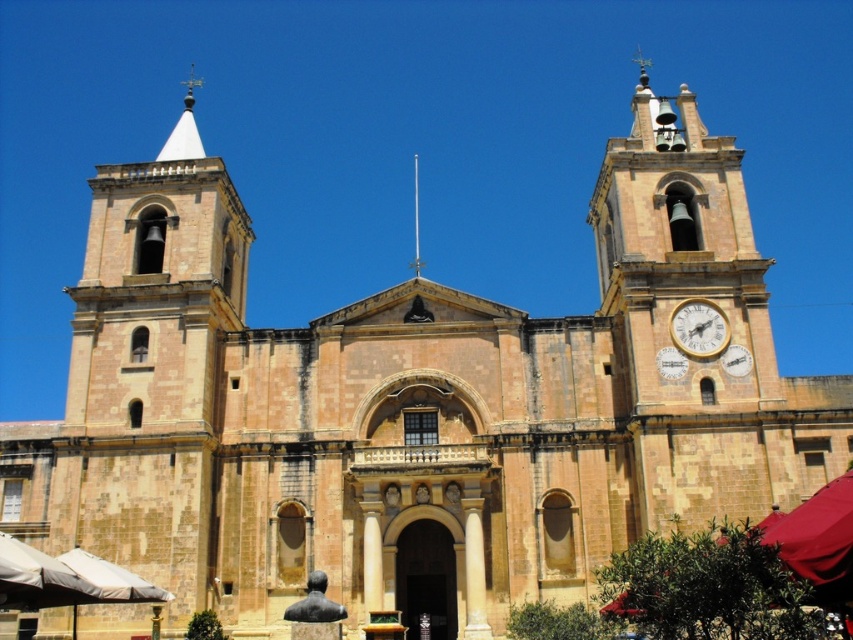
Which is more to the left, gold metallic clock at right or metallic spire at center?

metallic spire at center is more to the left.

Measure the distance between gold metallic clock at right and metallic spire at center.

gold metallic clock at right is 147.36 feet from metallic spire at center.

Measure the distance between point (704,320) and camera.

55.46 meters

The width and height of the screenshot is (853, 640). Identify the location of gold metallic clock at right. (699, 328).